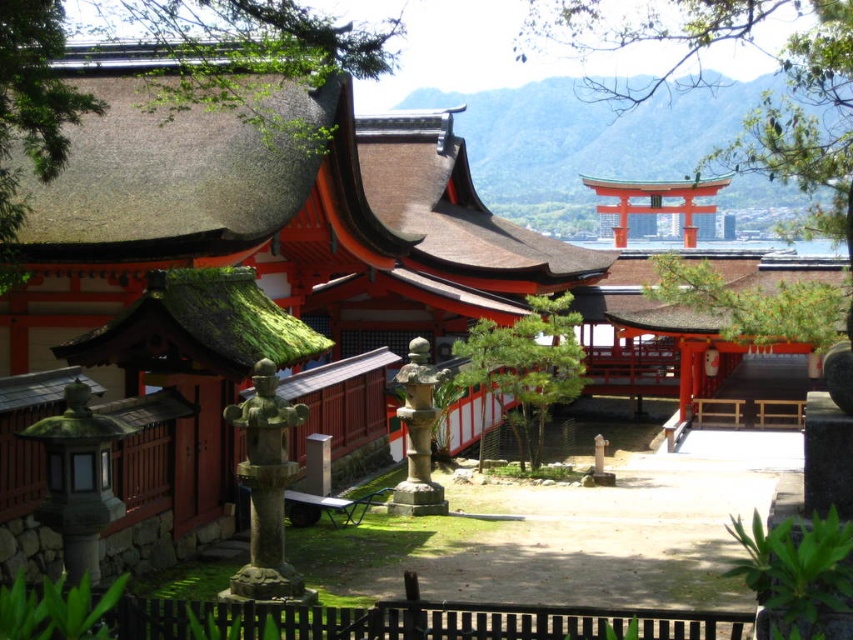
Question: Which point is farther to the camera?

Choices:
 (A) green textured pine tree at center
 (B) gray stone statue at center
 (C) green thatch roof at upper left
 (D) stone lantern at center

Answer: (D)

Question: Can you confirm if green thatch roof at upper left is positioned to the right of green textured pine tree at center?

Choices:
 (A) no
 (B) yes

Answer: (A)

Question: Observing the image, what is the correct spatial positioning of green thatch roof at upper left in reference to green textured pine tree at center?

Choices:
 (A) below
 (B) above

Answer: (B)

Question: Does green textured stone at center have a smaller size compared to green textured pine tree at center?

Choices:
 (A) yes
 (B) no

Answer: (A)

Question: Which point is farther to the camera?

Choices:
 (A) green textured pine tree at center
 (B) green thatch roof at upper left
 (C) stone lantern at center
 (D) green textured stone at center

Answer: (D)

Question: Which point is closer to the camera?

Choices:
 (A) (305, 80)
 (B) (795, 300)
 (C) (407, 512)
 (D) (553, 337)

Answer: (C)